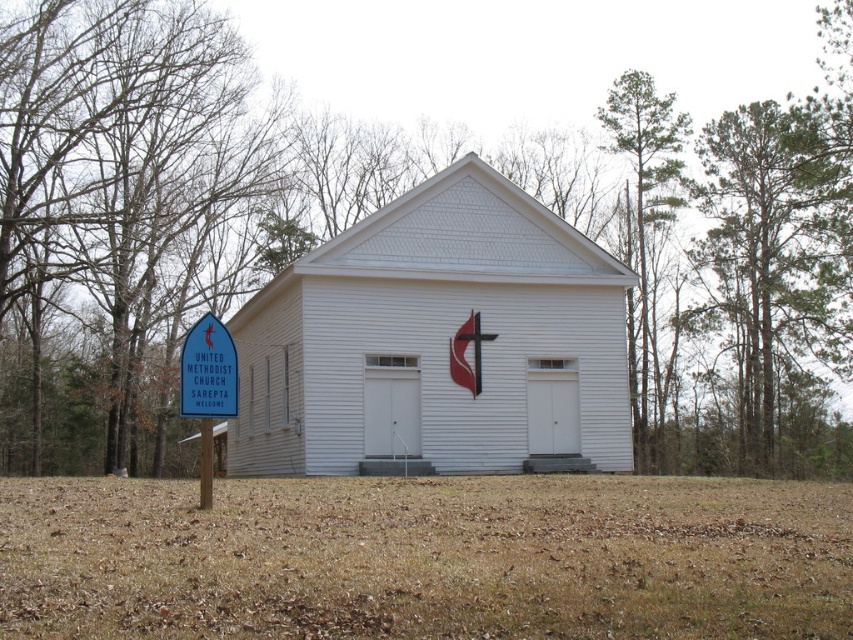
Question: Can you confirm if white wooden church at center is positioned to the left of blue plastic sign at left?

Choices:
 (A) no
 (B) yes

Answer: (A)

Question: Is white wooden church at center below blue plastic sign at left?

Choices:
 (A) no
 (B) yes

Answer: (B)

Question: Does white wooden church at center appear on the left side of blue plastic sign at left?

Choices:
 (A) yes
 (B) no

Answer: (B)